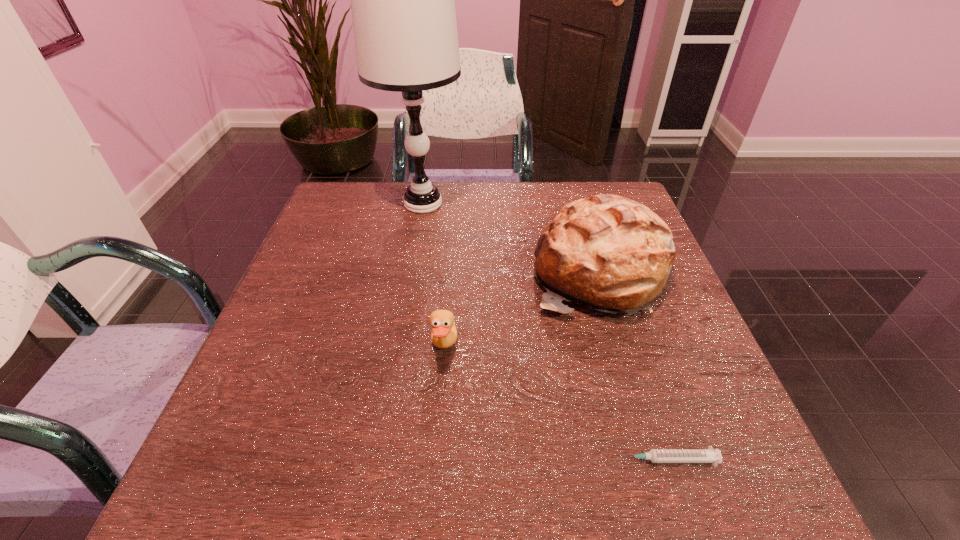
Where is `vacant space in between the third tallest object and the nearest object`? This screenshot has width=960, height=540. vacant space in between the third tallest object and the nearest object is located at coordinates (555, 404).

Identify the location of free area in between the third nearest object and the shortest object. The image size is (960, 540). (633, 366).

Where is `vacant space that is in between the syringe and the third nearest object`? The width and height of the screenshot is (960, 540). vacant space that is in between the syringe and the third nearest object is located at coordinates (633, 366).

This screenshot has width=960, height=540. I want to click on free point between the shortest object and the tallest object, so click(x=544, y=332).

You are a GUI agent. You are given a task and a screenshot of the screen. Output one action in this format:
    pyautogui.click(x=<x>, y=<y>)
    Task: Click on the free point between the farthest object and the syringe
    The height and width of the screenshot is (540, 960).
    Given the screenshot: What is the action you would take?
    pyautogui.click(x=544, y=332)

The height and width of the screenshot is (540, 960). In order to click on free space between the second nearest object and the second tallest object in this screenshot , I will do `click(522, 310)`.

At what (x,y) coordinates should I click in order to perform the action: click on object that is the closest to the farthest object. Please return your answer as a coordinate pair (x, y). Looking at the image, I should click on (611, 253).

Locate which object is the third closest to the tallest object. Please provide its 2D coordinates. Your answer should be formatted as a tuple, i.e. [(x, y)], where the tuple contains the x and y coordinates of a point satisfying the conditions above.

[(709, 455)]